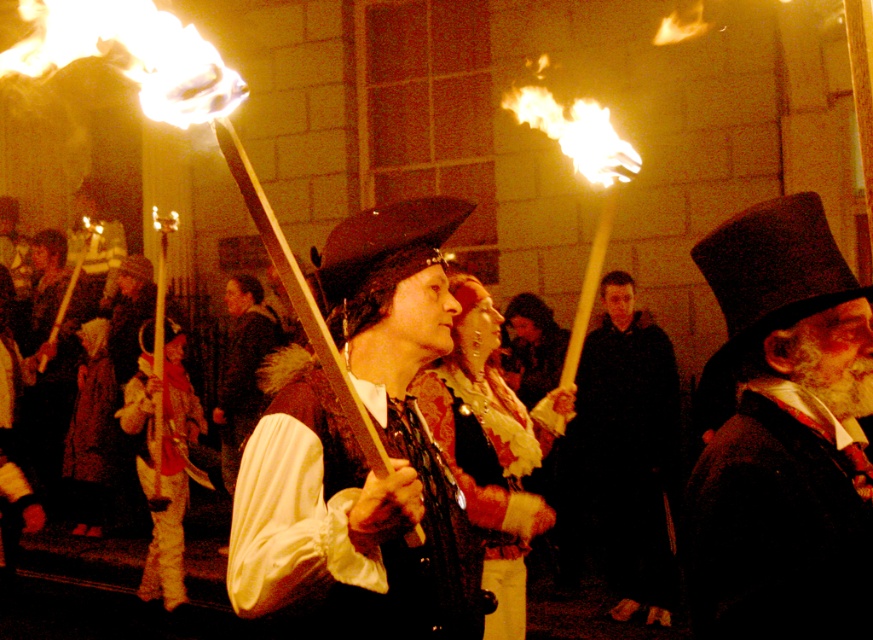
Question: In this image, where is velvet red cape at center located relative to velvet yellow pants at center?

Choices:
 (A) below
 (B) above

Answer: (B)

Question: Which point appears closest to the camera in this image?

Choices:
 (A) tap(643, 554)
 (B) tap(255, 506)
 (C) tap(524, 554)
 (D) tap(750, 593)

Answer: (D)

Question: Among these points, which one is nearest to the camera?

Choices:
 (A) (517, 410)
 (B) (373, 632)

Answer: (B)

Question: Estimate the real-world distances between objects in this image. Which object is closer to the dark matte coat at center?

Choices:
 (A) smooth brown coat at center
 (B) shiny black sword at center
 (C) velvet red cape at center
 (D) dark woolen top hat at right

Answer: (C)

Question: Where is velvet yellow pants at center located in relation to smooth brown coat at center in the image?

Choices:
 (A) left
 (B) right

Answer: (A)

Question: Does shiny black sword at center appear over velvet yellow pants at center?

Choices:
 (A) no
 (B) yes

Answer: (B)